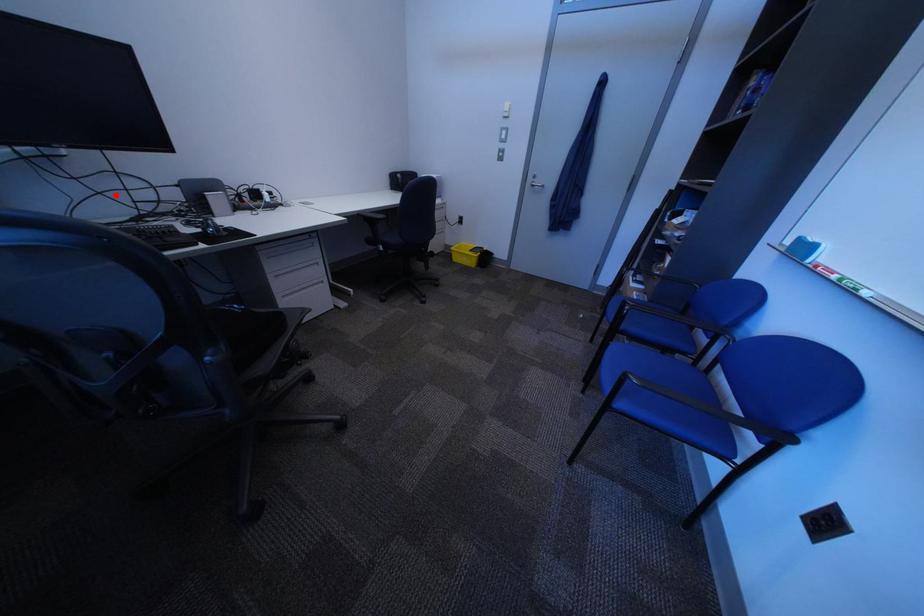
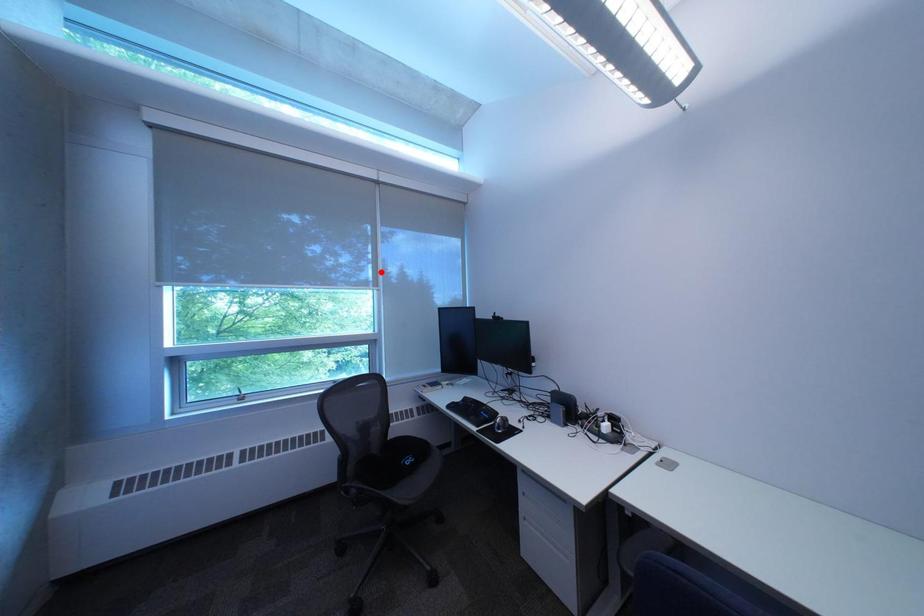
I am providing you with two images of the same scene from different viewpoints. A red point is marked on the first image and another point is marked on the second image. Does the point marked in image1 correspond to the same location as the one in image2?

No